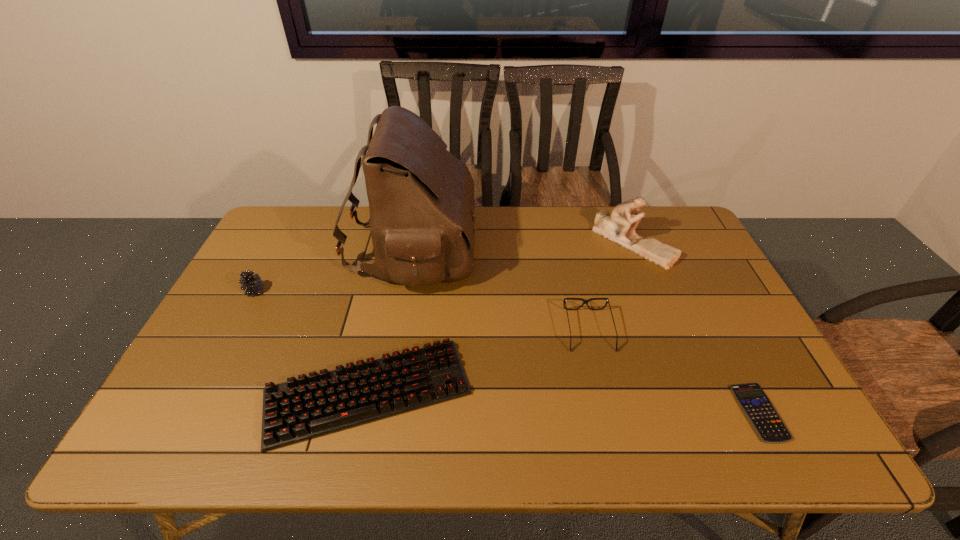
Find the location of a particular element. The width and height of the screenshot is (960, 540). calculator at the right edge is located at coordinates (759, 410).

Image resolution: width=960 pixels, height=540 pixels. I want to click on object that is at the far right corner, so click(x=619, y=227).

I want to click on object present at the near right corner, so click(759, 410).

I want to click on vacant space at the far edge, so click(587, 218).

The height and width of the screenshot is (540, 960). I want to click on vacant space at the near edge, so click(576, 444).

The image size is (960, 540). Identify the location of free region at the left edge of the desktop. (264, 332).

Where is `blank space at the right edge of the desktop`? This screenshot has height=540, width=960. blank space at the right edge of the desktop is located at coordinates (712, 316).

Image resolution: width=960 pixels, height=540 pixels. I want to click on vacant space that's between the satchel and the spectacles, so click(501, 289).

I want to click on free space between the calculator and the satchel, so click(x=587, y=330).

At what (x,y) coordinates should I click in order to perform the action: click on vacant area that lies between the third object from right to left and the satchel. Please return your answer as a coordinate pair (x, y). This screenshot has height=540, width=960. Looking at the image, I should click on (501, 289).